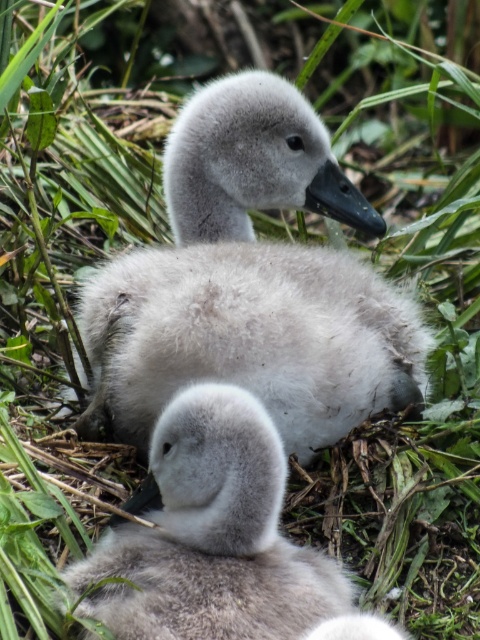
Between point (224, 376) and point (228, 632), which one is positioned in front?

Point (228, 632) is in front.

Is the position of fluffy gray swan at upper center less distant than that of soft gray down at center?

No.

Is point (314, 269) closer to viewer compared to point (223, 484)?

No, (314, 269) is further to viewer.

The width and height of the screenshot is (480, 640). Identify the location of fluffy gray swan at upper center. (251, 284).